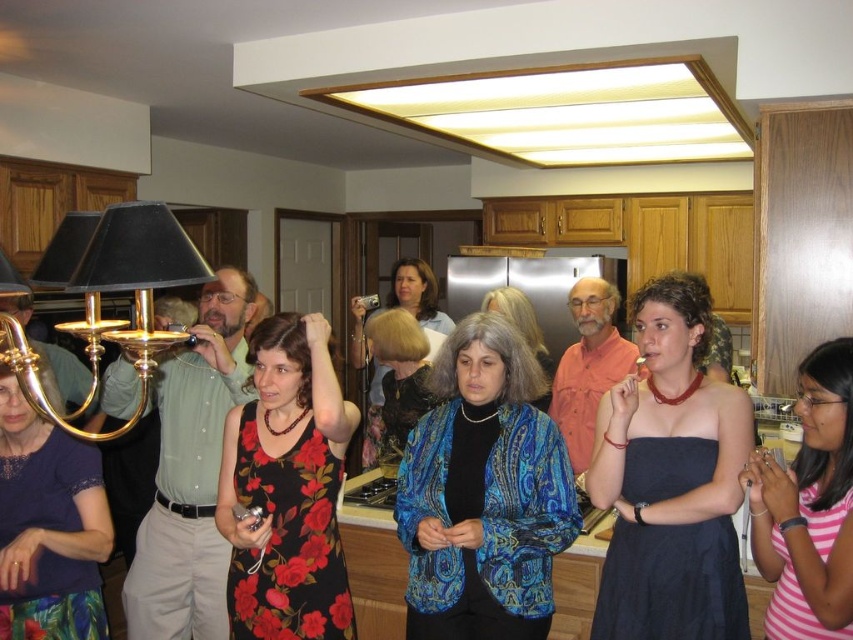
Question: Is floral dress at center to the right of pink striped dress at lower right from the viewer's perspective?

Choices:
 (A) yes
 (B) no

Answer: (B)

Question: Does floral dress at center appear under pink striped dress at lower right?

Choices:
 (A) no
 (B) yes

Answer: (B)

Question: Which object is positioned closest to the black satin dress at center?

Choices:
 (A) blue paisley jacket at center
 (B) pink striped dress at lower right
 (C) gold brass chandelier at upper left
 (D) floral dress at center

Answer: (A)

Question: Which point appears closest to the camera in this image?

Choices:
 (A) (494, 292)
 (B) (250, 337)
 (C) (392, 298)

Answer: (B)

Question: Which point is farther from the camera taking this photo?

Choices:
 (A) (608, 406)
 (B) (397, 298)
 (C) (125, 225)

Answer: (B)

Question: Does pink striped dress at lower right appear on the left side of blue paisley jacket at center?

Choices:
 (A) no
 (B) yes

Answer: (A)